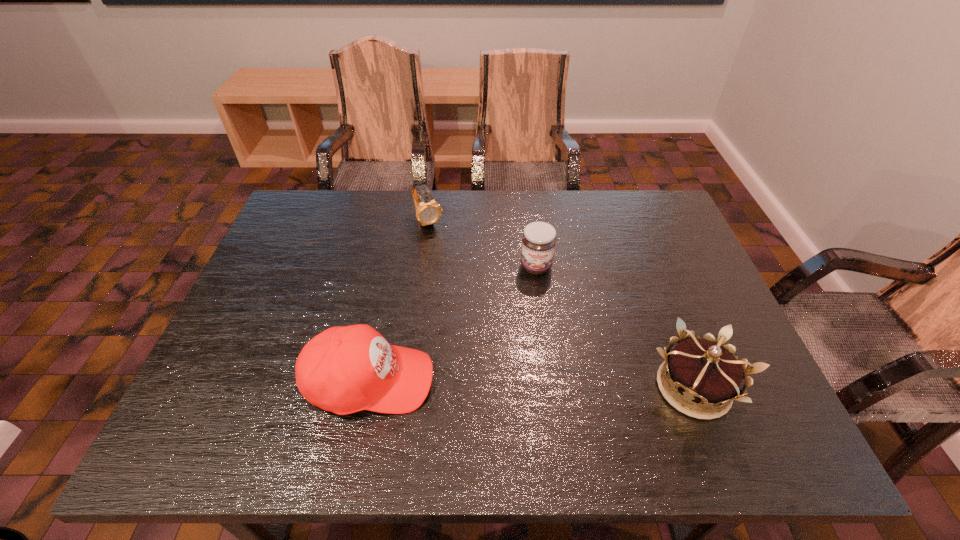
At what (x,y) coordinates should I click in order to perform the action: click on free spot on the desktop that is between the baseball cap and the crown and is positioned on the front label of the jam. Please return your answer as a coordinate pair (x, y). This screenshot has width=960, height=540. Looking at the image, I should click on (543, 384).

The width and height of the screenshot is (960, 540). Identify the location of vacant space on the desktop that is between the baseball cap and the crown and is positioned on the face of the watch. (521, 384).